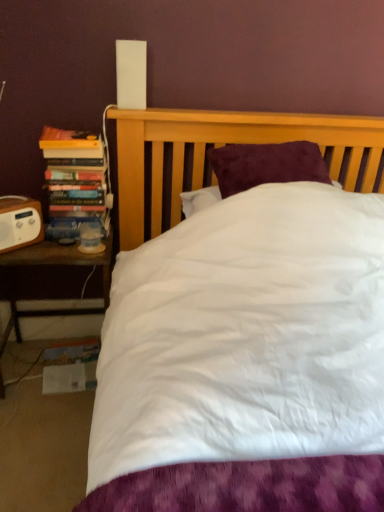
Question: Is brown wooden nightstand at left bigger or smaller than white plastic speaker at left?

Choices:
 (A) big
 (B) small

Answer: (A)

Question: Is brown wooden nightstand at left to the left or to the right of white plastic speaker at left in the image?

Choices:
 (A) left
 (B) right

Answer: (B)

Question: Based on their relative distances, which object is nearer to the hardcover books at left?

Choices:
 (A) white plastic speaker at left
 (B) brown wooden nightstand at left

Answer: (A)

Question: Based on their relative distances, which object is farther from the white plastic speaker at left?

Choices:
 (A) brown wooden nightstand at left
 (B) hardcover books at left

Answer: (A)